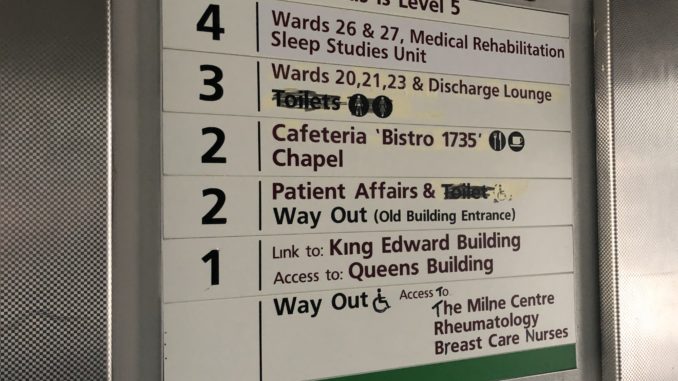
You are a GUI agent. You are given a task and a screenshot of the screen. Output one action in this format:
    pyautogui.click(x=<x>, y=<y>)
    Task: Click on the light gray wall
    
    Given the screenshot: What is the action you would take?
    pyautogui.click(x=127, y=127)